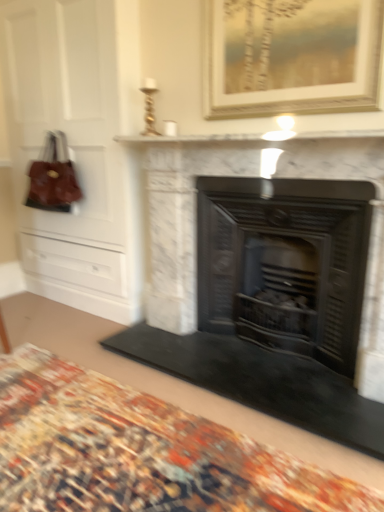
You are a GUI agent. You are given a task and a screenshot of the screen. Output one action in this format:
    pyautogui.click(x=<x>, y=<y>)
    Task: Click on the leather handbag at left
    The width and height of the screenshot is (384, 512).
    Given the screenshot: What is the action you would take?
    pyautogui.click(x=53, y=179)

What do you see at coordinates (291, 56) in the screenshot? I see `gold-framed painting at upper center` at bounding box center [291, 56].

This screenshot has width=384, height=512. What are the coordinates of `white marble fireplace at upper center` in the screenshot? It's located at (191, 138).

Identify the location of carpeted rug at lower center. This screenshot has width=384, height=512. (139, 451).

Considering the sizes of objects carpeted rug at lower center and white marble fireplace at upper center in the image provided, who is shorter, carpeted rug at lower center or white marble fireplace at upper center?

carpeted rug at lower center.

Is carpeted rug at lower center facing away from white marble fireplace at upper center?

No, carpeted rug at lower center is not facing away from white marble fireplace at upper center.

Considering the relative positions of carpeted rug at lower center and white marble fireplace at upper center in the image provided, is carpeted rug at lower center to the right of white marble fireplace at upper center from the viewer's perspective?

In fact, carpeted rug at lower center is to the left of white marble fireplace at upper center.

From the image's perspective, is carpeted rug at lower center over white marble fireplace at upper center?

No, from the image's perspective, carpeted rug at lower center is not on top of white marble fireplace at upper center.

Which of these two, leather handbag at left or white marble fireplace at upper center, is thinner?

leather handbag at left is thinner.

Is leather handbag at left oriented towards white marble fireplace at upper center?

No.

Considering their positions, is leather handbag at left located in front of or behind white marble fireplace at upper center?

In the image, leather handbag at left appears behind white marble fireplace at upper center.

Is leather handbag at left inside the boundaries of white marble fireplace at upper center, or outside?

leather handbag at left is not inside white marble fireplace at upper center, it's outside.

Which is in front, point (241, 42) or point (253, 366)?

The point (241, 42) is more forward.

Is gold-framed painting at upper center taller than white marble fireplace at center, the first fireplace in the left-to-right sequence?

In fact, gold-framed painting at upper center may be shorter than white marble fireplace at center, the first fireplace in the left-to-right sequence.

From a real-world perspective, between gold-framed painting at upper center and white marble fireplace at center, the second fireplace when ordered from right to left, who is vertically higher?

From a 3D spatial view, gold-framed painting at upper center is above.

Which is in front, gold-framed painting at upper center or white marble fireplace at center, the first fireplace in the left-to-right sequence?

white marble fireplace at center, the first fireplace in the left-to-right sequence.

Is white marble fireplace at upper center outside of leather handbag at left?

white marble fireplace at upper center lies outside leather handbag at left's area.

Are white marble fireplace at upper center and leather handbag at left located far from each other?

white marble fireplace at upper center is actually quite close to leather handbag at left.

From a real-world perspective, is white marble fireplace at upper center over leather handbag at left?

Yes, from a real-world perspective, white marble fireplace at upper center is on top of leather handbag at left.

Identify the location of mantle that is above the leather handbag at left (from the image's perspective). (191, 138).

Could you tell me if leather handbag at left is turned towards black metal fireplace at center, the second fireplace when ordered from left to right?

No, leather handbag at left does not turn towards black metal fireplace at center, the second fireplace when ordered from left to right.

This screenshot has width=384, height=512. In order to click on handbag to the left of black metal fireplace at center, the second fireplace when ordered from left to right in this screenshot , I will do `click(53, 179)`.

Considering the relative positions of leather handbag at left and black metal fireplace at center, which ranks as the 1th fireplace in right-to-left order, in the image provided, is leather handbag at left behind black metal fireplace at center, which ranks as the 1th fireplace in right-to-left order,?

Yes, leather handbag at left is behind black metal fireplace at center, which ranks as the 1th fireplace in right-to-left order.

From the picture: Which is more distant, (46, 191) or (289, 204)?

The point (46, 191) is behind.

From a real-world perspective, is black metal fireplace at center, the second fireplace when ordered from left to right, positioned under carpeted rug at lower center based on gravity?

Actually, black metal fireplace at center, the second fireplace when ordered from left to right, is physically above carpeted rug at lower center in the real world.

Is black metal fireplace at center, the second fireplace when ordered from left to right, with carpeted rug at lower center?

black metal fireplace at center, the second fireplace when ordered from left to right, is not next to carpeted rug at lower center, and they're not touching.

Does black metal fireplace at center, which ranks as the 1th fireplace in right-to-left order, lie behind carpeted rug at lower center?

Yes, it is.

Which of these two, black metal fireplace at center, which ranks as the 1th fireplace in right-to-left order, or carpeted rug at lower center, is bigger?

With larger size is black metal fireplace at center, which ranks as the 1th fireplace in right-to-left order.

Between black metal fireplace at center, the second fireplace when ordered from left to right, and white marble fireplace at center, the second fireplace when ordered from right to left, which one has larger size?

white marble fireplace at center, the second fireplace when ordered from right to left.

From a real-world perspective, is black metal fireplace at center, which ranks as the 1th fireplace in right-to-left order, positioned under white marble fireplace at center, the second fireplace when ordered from right to left, based on gravity?

Yes, from a real-world perspective, black metal fireplace at center, which ranks as the 1th fireplace in right-to-left order, is below white marble fireplace at center, the second fireplace when ordered from right to left.

How far apart are black metal fireplace at center, which ranks as the 1th fireplace in right-to-left order, and white marble fireplace at center, the second fireplace when ordered from right to left?

black metal fireplace at center, which ranks as the 1th fireplace in right-to-left order, and white marble fireplace at center, the second fireplace when ordered from right to left, are 2.50 inches apart from each other.

Can you see black metal fireplace at center, the second fireplace when ordered from left to right, touching white marble fireplace at center, the second fireplace when ordered from right to left?

Yes, black metal fireplace at center, the second fireplace when ordered from left to right, and white marble fireplace at center, the second fireplace when ordered from right to left, clearly make contact.

What are the coordinates of `mantle that appears above the carpeted rug at lower center (from the image's perspective)` in the screenshot? It's located at (191, 138).

I want to click on handbag behind the white marble fireplace at upper center, so click(x=53, y=179).

Looking at the image, which one is located further to leather handbag at left, black metal fireplace at center, the second fireplace when ordered from left to right, or white marble fireplace at center, the second fireplace when ordered from right to left?

Among the two, black metal fireplace at center, the second fireplace when ordered from left to right, is located further to leather handbag at left.

Based on their spatial positions, is gold-framed painting at upper center or white marble fireplace at center, the second fireplace when ordered from right to left, closer to white marble fireplace at upper center?

→ gold-framed painting at upper center lies closer to white marble fireplace at upper center than the other object.

Considering their positions, is white marble fireplace at center, the second fireplace when ordered from right to left, positioned further to carpeted rug at lower center than matte brown leather dresser at left?

matte brown leather dresser at left lies further to carpeted rug at lower center than the other object.

Which object lies nearer to the anchor point leather handbag at left, gold-framed painting at upper center or white marble fireplace at upper center?

Based on the image, white marble fireplace at upper center appears to be nearer to leather handbag at left.

Based on their spatial positions, is black metal fireplace at center, the second fireplace when ordered from left to right, or white marble fireplace at upper center further from white marble fireplace at center, the second fireplace when ordered from right to left?

white marble fireplace at upper center is positioned further to the anchor white marble fireplace at center, the second fireplace when ordered from right to left.

Which object lies nearer to the anchor point black metal fireplace at center, which ranks as the 1th fireplace in right-to-left order, gold-framed painting at upper center or matte brown leather dresser at left?

Among the two, gold-framed painting at upper center is located nearer to black metal fireplace at center, which ranks as the 1th fireplace in right-to-left order.

Based on their spatial positions, is white marble fireplace at center, the first fireplace in the left-to-right sequence, or leather handbag at left closer to black metal fireplace at center, which ranks as the 1th fireplace in right-to-left order?

white marble fireplace at center, the first fireplace in the left-to-right sequence, lies closer to black metal fireplace at center, which ranks as the 1th fireplace in right-to-left order, than the other object.

Looking at the image, which one is located closer to leather handbag at left, black metal fireplace at center, which ranks as the 1th fireplace in right-to-left order, or gold-framed painting at upper center?

Among the two, black metal fireplace at center, which ranks as the 1th fireplace in right-to-left order, is located nearer to leather handbag at left.

Identify the location of mantle between carpeted rug at lower center and leather handbag at left in the front-back direction. (191, 138).

Where is `dresser between leather handbag at left and gold-framed painting at upper center in the horizontal direction`? The image size is (384, 512). dresser between leather handbag at left and gold-framed painting at upper center in the horizontal direction is located at coordinates (74, 154).

I want to click on mantle between leather handbag at left and white marble fireplace at center, the first fireplace in the left-to-right sequence, so click(191, 138).

Find the location of a particular element. The width and height of the screenshot is (384, 512). mantle between leather handbag at left and gold-framed painting at upper center is located at coordinates (191, 138).